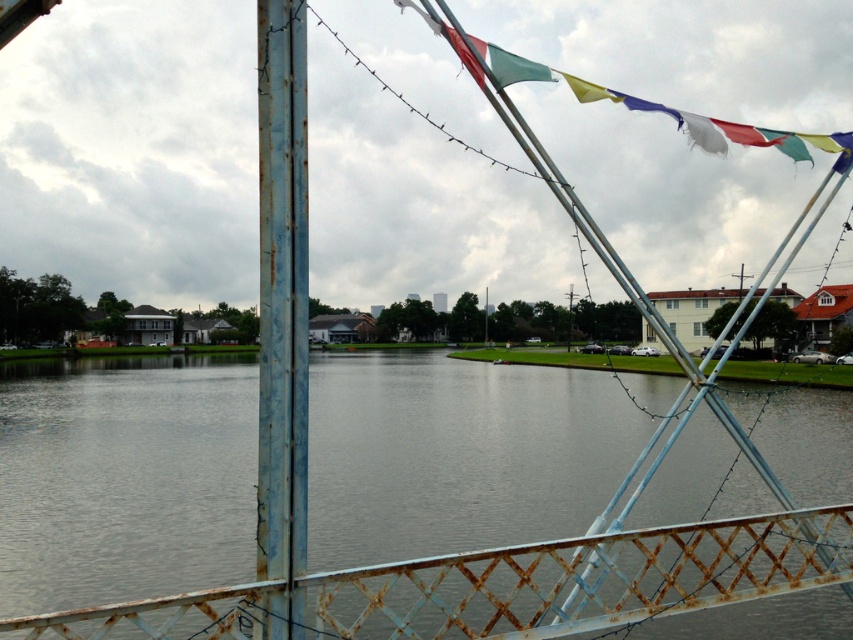
Between point (550, 477) and point (813, 138), which one is positioned in front?

Point (813, 138)

Can you confirm if gray metallic water at center is thinner than rusty metal flag at upper right?

No, gray metallic water at center is not thinner than rusty metal flag at upper right.

Describe the element at coordinates (125, 480) in the screenshot. I see `gray metallic water at center` at that location.

Identify the location of gray metallic water at center. (125, 480).

Can you confirm if gray metallic water at center is smaller than rusty metal pole at left?

No, gray metallic water at center is not smaller than rusty metal pole at left.

Is point (442, 422) positioned before point (264, 576)?

That is False.

Image resolution: width=853 pixels, height=640 pixels. In order to click on gray metallic water at center in this screenshot , I will do `click(125, 480)`.

Between rusty metal pole at left and rusty metal flag at upper right, which one has less height?

With less height is rusty metal pole at left.

Who is lower down, rusty metal pole at left or rusty metal flag at upper right?

rusty metal pole at left is below.

Between point (281, 56) and point (498, 86), which one is positioned behind?

The point (498, 86) is more distant.

This screenshot has height=640, width=853. Find the location of `rusty metal pole at left`. rusty metal pole at left is located at coordinates (282, 310).